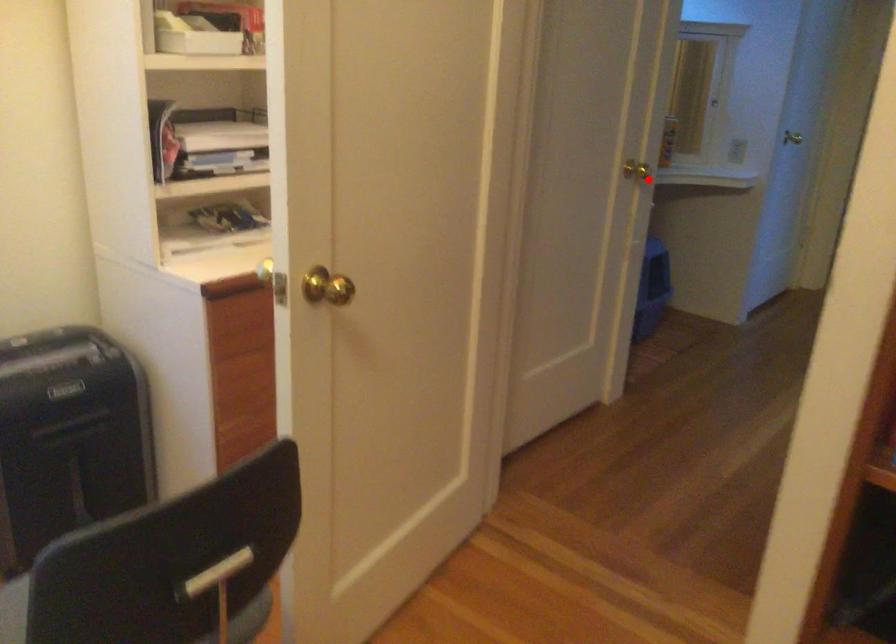
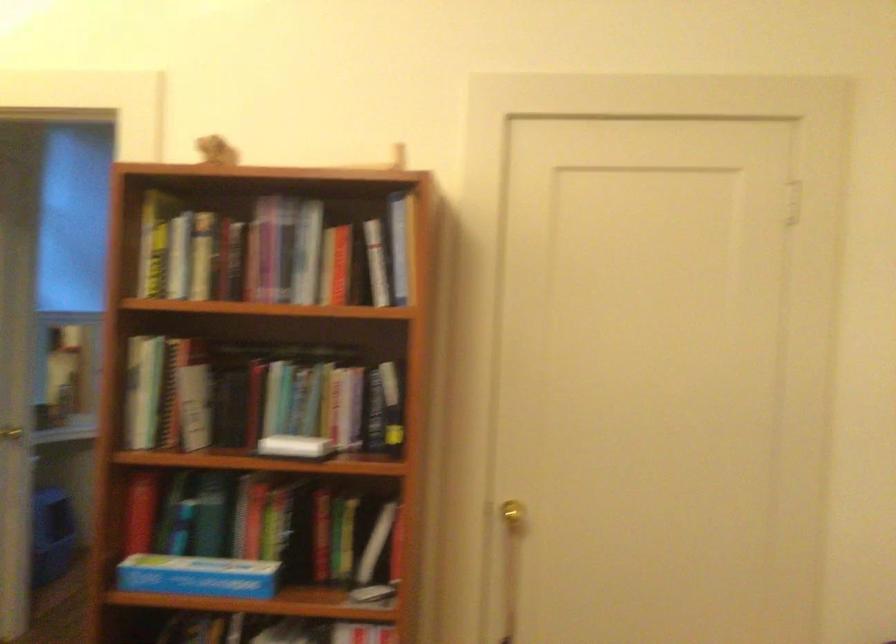
Question: I am providing you with two images of the same scene from different viewpoints. In image1, a red point is highlighted. Considering the same 3D point in image2, which of the following is correct?

Choices:
 (A) It is closer
 (B) It is farther

Answer: (B)